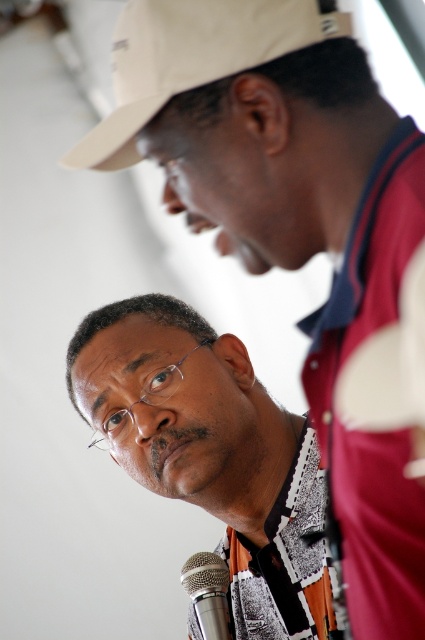
Between point (136, 104) and point (207, 554), which one is positioned in front?

Point (136, 104) is in front.

Is beige fabric cap at upper center closer to camera compared to silver metallic microphone at lower center?

Yes, it is.

Identify the location of beige fabric cap at upper center. The height and width of the screenshot is (640, 425). (192, 58).

Is white textured shirt at center further to the viewer compared to beige fabric cap at upper center?

Yes, it is behind beige fabric cap at upper center.

What do you see at coordinates (212, 452) in the screenshot? I see `white textured shirt at center` at bounding box center [212, 452].

Identify the location of white textured shirt at center. (212, 452).

Can you confirm if white textured shirt at center is wider than silver metallic microphone at lower center?

Indeed, white textured shirt at center has a greater width compared to silver metallic microphone at lower center.

Is point (173, 307) positioned in front of point (190, 573)?

That is False.

Consider the image. Who is more distant from viewer, (161, 380) or (214, 620)?

Positioned behind is point (214, 620).

This screenshot has width=425, height=640. What are the coordinates of `white textured shirt at center` in the screenshot? It's located at (212, 452).